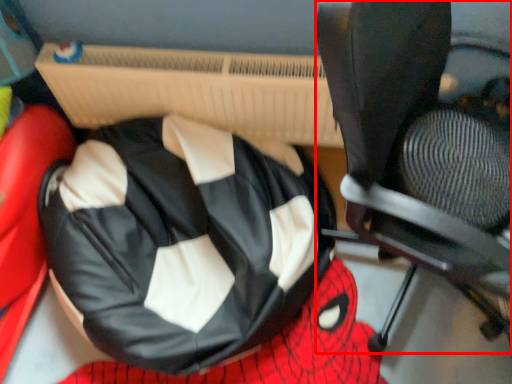
Question: From the image's perspective, considering the relative positions of chair (annotated by the red box) and bean bag chair in the image provided, where is chair (annotated by the red box) located with respect to the staircase?

Choices:
 (A) above
 (B) below

Answer: (A)